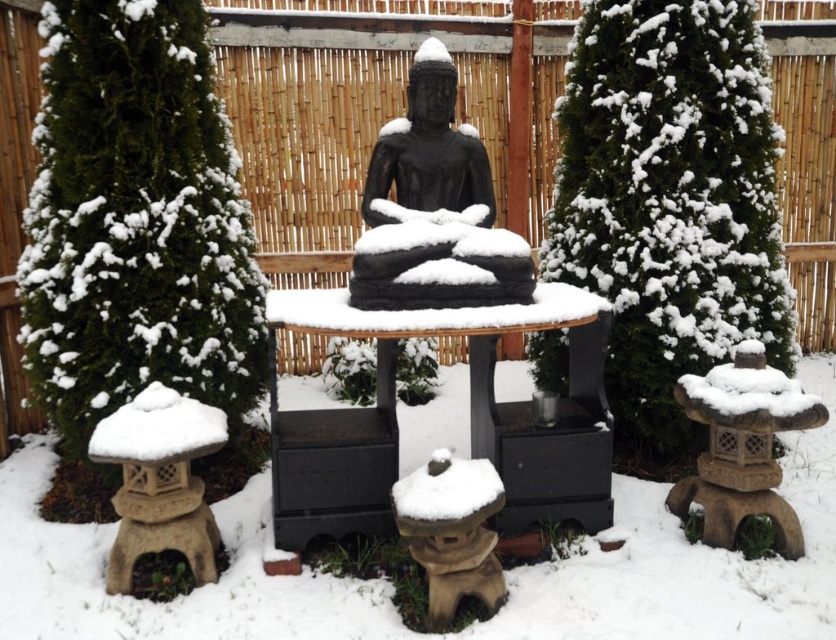
Is black matte table at center further to the viewer compared to black stone statue at center?

No, black matte table at center is in front of black stone statue at center.

You are a GUI agent. You are given a task and a screenshot of the screen. Output one action in this format:
    pyautogui.click(x=<x>, y=<y>)
    Task: Click on the black matte table at center
    Image resolution: width=836 pixels, height=640 pixels.
    Given the screenshot: What is the action you would take?
    pyautogui.click(x=469, y=419)

Where is `black matte table at center`? Image resolution: width=836 pixels, height=640 pixels. black matte table at center is located at coordinates (469, 419).